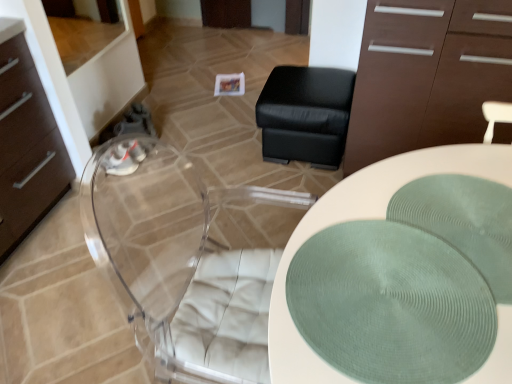
At what (x,y) coordinates should I click in order to perform the action: click on free point below green textured placemat at center (from a real-world perspective). Please return your answer as a coordinate pair (x, y). Looking at the image, I should click on (444, 234).